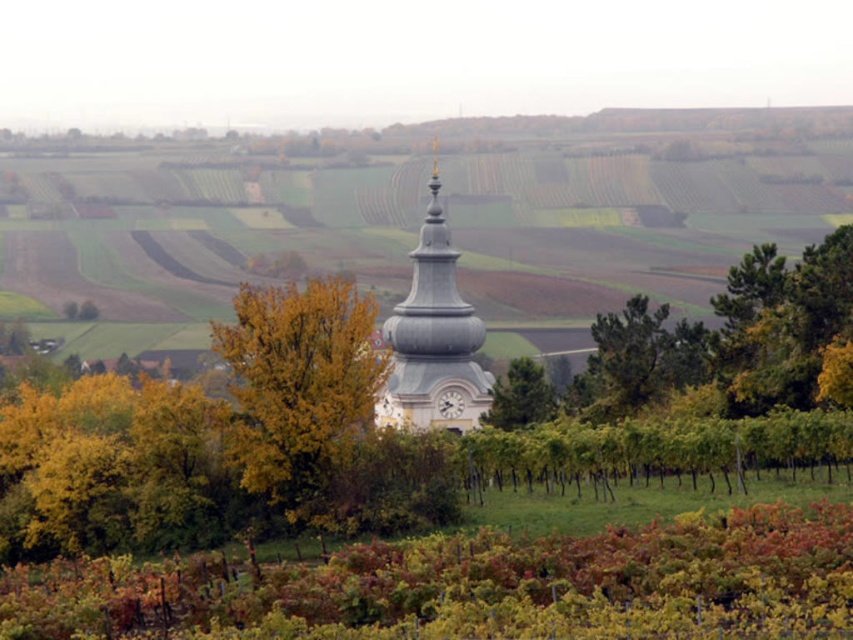
Based on the scene described, which object occupies more horizontal space in the image? Please consider the white stucco clock tower at center and the green leafy tree at center in your answer.

The white stucco clock tower at center might be wider than the green leafy tree at center, so it likely occupies more horizontal space in the image.

You are standing at the base of the clock tower in the vineyard. You see two points marked in the scene. Which point is closer to you, point (305,296) or point (508,369)?

Point (305,296) is in front of point (508,369), so it is closer to you.